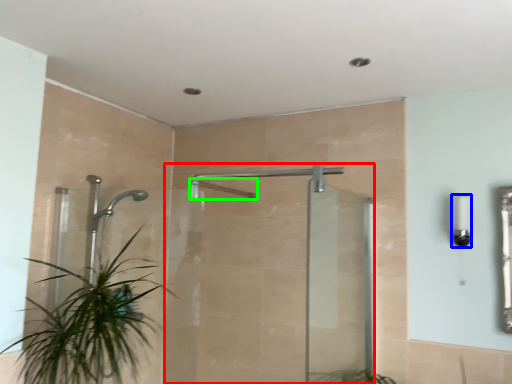
Question: Considering the real-world distances, which object is farthest from screen door (highlighted by a red box)? light fixture (highlighted by a blue box) or shower (highlighted by a green box)?

Choices:
 (A) light fixture
 (B) shower

Answer: (A)